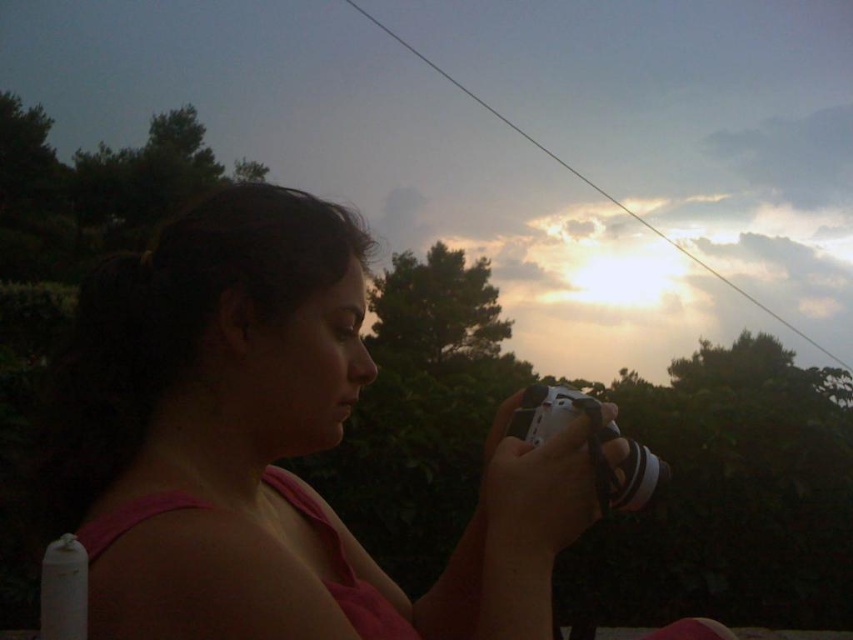
Question: Which point is closer to the camera?

Choices:
 (A) white plastic camera at center
 (B) pink fabric at center

Answer: (B)

Question: Which point is farther to the camera?

Choices:
 (A) (558, 400)
 (B) (126, 554)

Answer: (A)

Question: Is pink fabric at center closer to the viewer compared to white plastic camera at center?

Choices:
 (A) no
 (B) yes

Answer: (B)

Question: Is pink fabric at center positioned in front of white plastic camera at center?

Choices:
 (A) yes
 (B) no

Answer: (A)

Question: Which point is farther to the camera?

Choices:
 (A) white plastic camera at center
 (B) pink fabric at center

Answer: (A)

Question: Does pink fabric at center appear under white plastic camera at center?

Choices:
 (A) yes
 (B) no

Answer: (A)